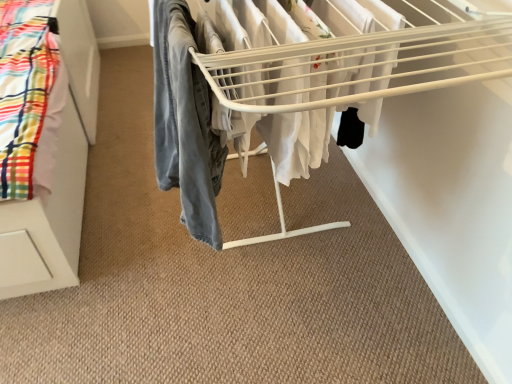
Question: Is point (173, 67) closer or farther from the camera than point (227, 110)?

Choices:
 (A) farther
 (B) closer

Answer: (A)

Question: Based on their sizes in the image, would you say denim pants at center is bigger or smaller than white plastic drying rack at center?

Choices:
 (A) small
 (B) big

Answer: (A)

Question: Based on their positions, is denim pants at center located to the left or right of white plastic drying rack at center?

Choices:
 (A) left
 (B) right

Answer: (A)

Question: Would you say white plastic drying rack at center is to the left or to the right of denim pants at center in the picture?

Choices:
 (A) right
 (B) left

Answer: (A)

Question: Does point (176, 140) appear closer or farther from the camera than point (160, 114)?

Choices:
 (A) closer
 (B) farther

Answer: (A)

Question: From the image's perspective, is white plastic drying rack at center above or below denim pants at center?

Choices:
 (A) below
 (B) above

Answer: (B)

Question: Is white plastic drying rack at center situated inside denim pants at center or outside?

Choices:
 (A) outside
 (B) inside

Answer: (A)